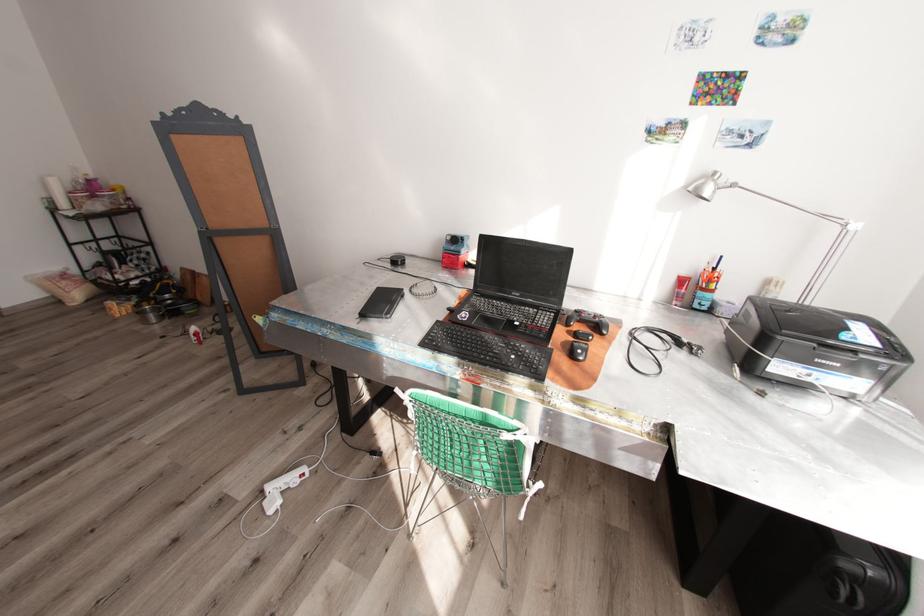
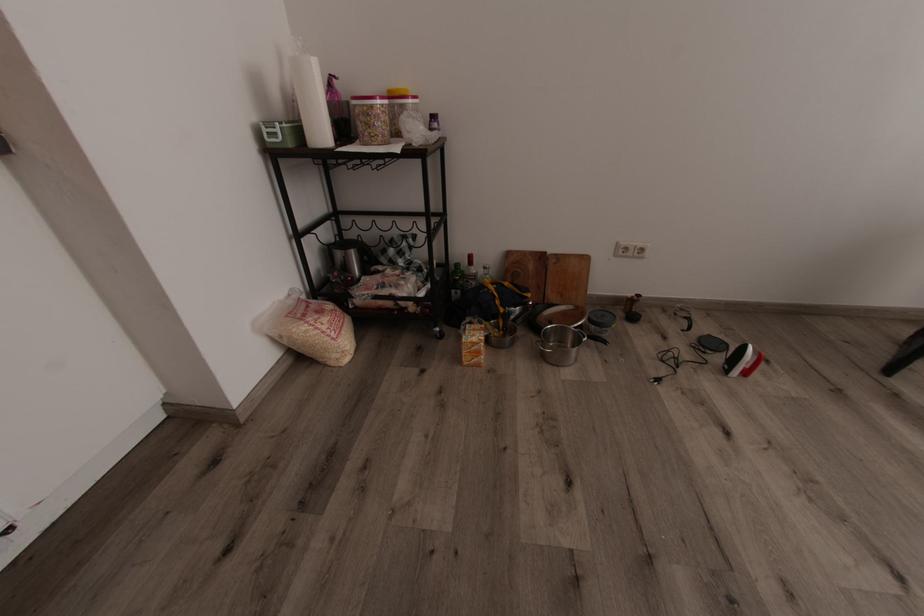
The point at (81,199) is marked in the first image. Where is the corresponding point in the second image?

(382, 116)